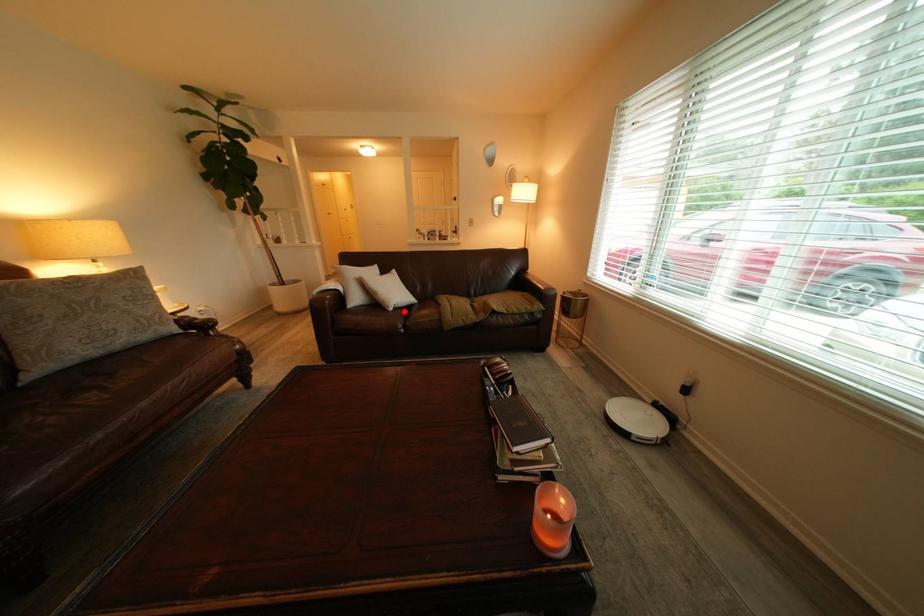
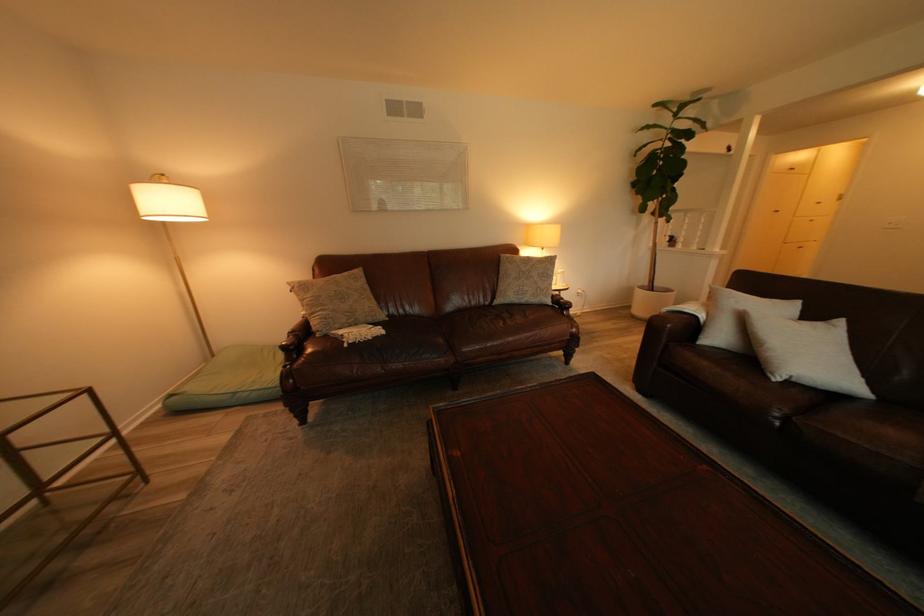
In the second image, find the point that corresponds to the highlighted location in the first image.

(787, 381)